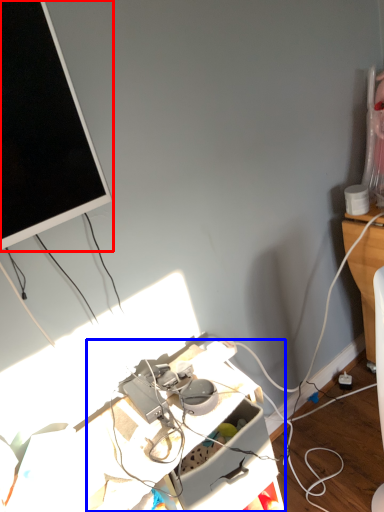
Question: Which point is closer to the camera, television (highlighted by a red box) or computer desk (highlighted by a blue box)?

Choices:
 (A) television
 (B) computer desk

Answer: (A)